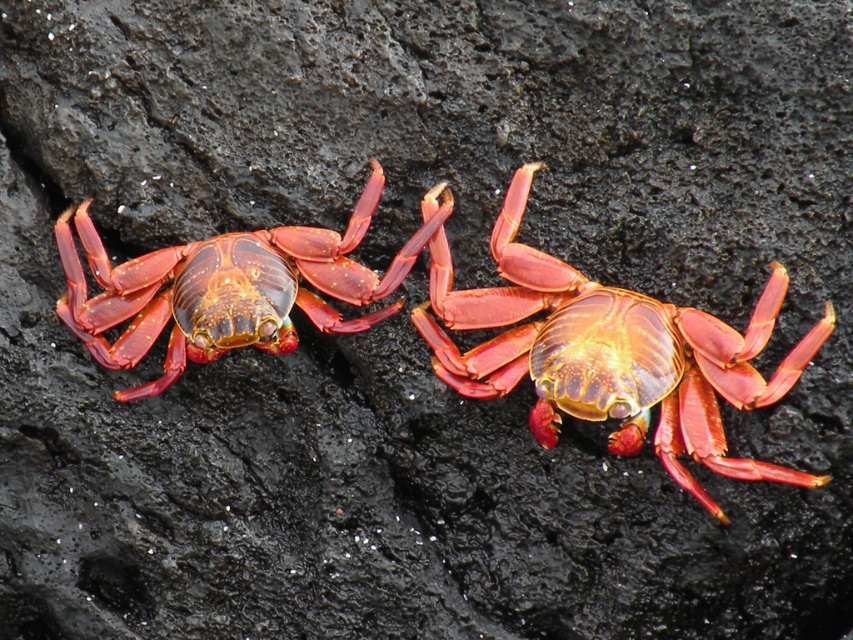
You are a photographer standing 1.5 meters away from the shiny red crab at center. Can you capture the crab in your camera frame without moving closer?

The shiny red crab at center and viewer are 1.42 meters apart, so yes, the photographer can capture the crab in the camera frame without moving closer since they are already within the required distance.

You are a biologist observing two shiny red crabs on a volcanic rock. You need to determine which one is taller. The crabs are the shiny red crab at center and the shiny red crab at left. Based on their positions, can you identify which one is taller?

The shiny red crab at center is taller than the shiny red crab at left according to the description.

Looking at this image, you are a wildlife photographer aiming to capture both the shiny red crab at center and the shiny red crab at left in a single closeup shot. Given that your camera can focus on objects within a 12 inch range, will both crabs fit within the camera focus range?

The shiny red crab at center is 10.00 inches from the shiny red crab at left. Since the camera can focus on objects within a 12 inch range, both crabs will fit within the camera focus range as the distance between them is less than 12 inches.